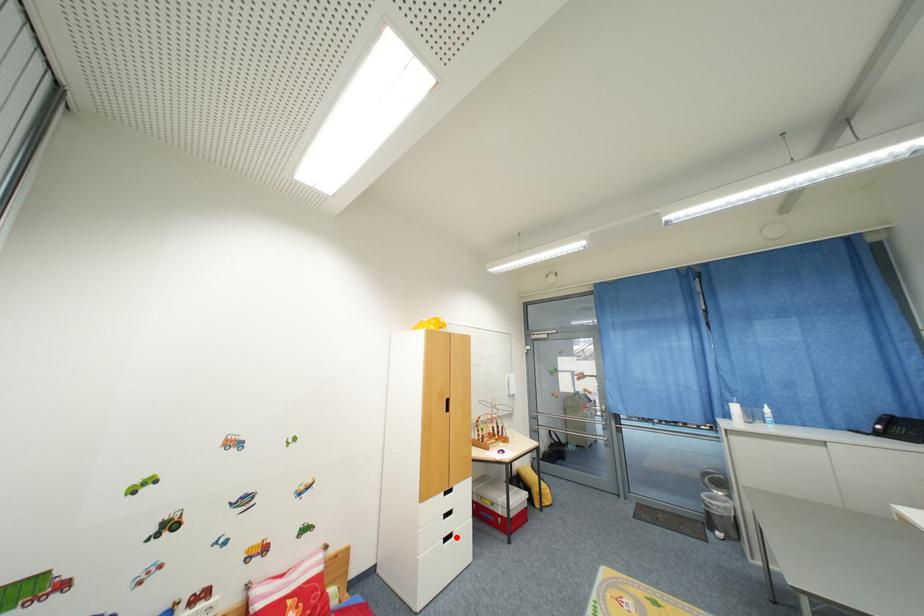
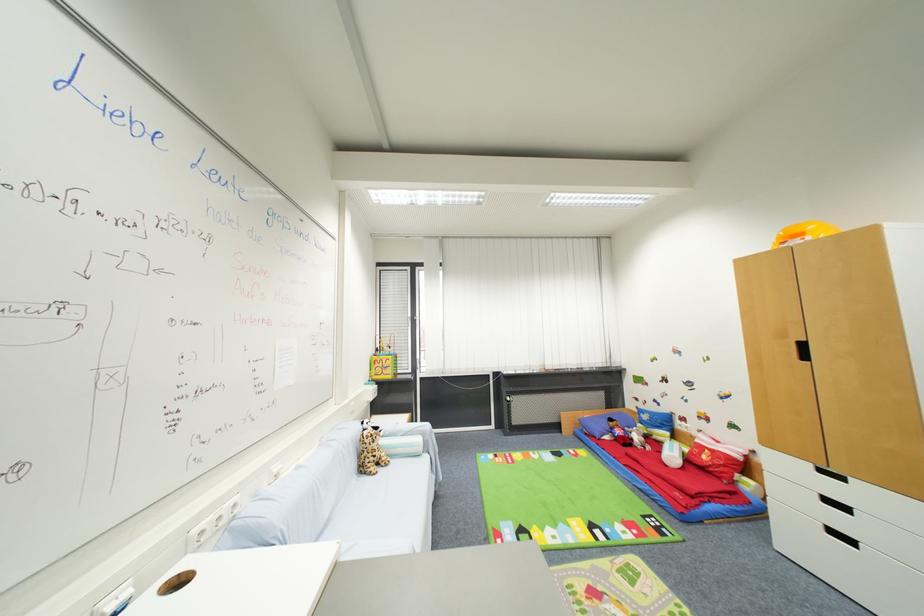
In the second image, find the point that corresponds to the highlighted location in the first image.

(857, 544)